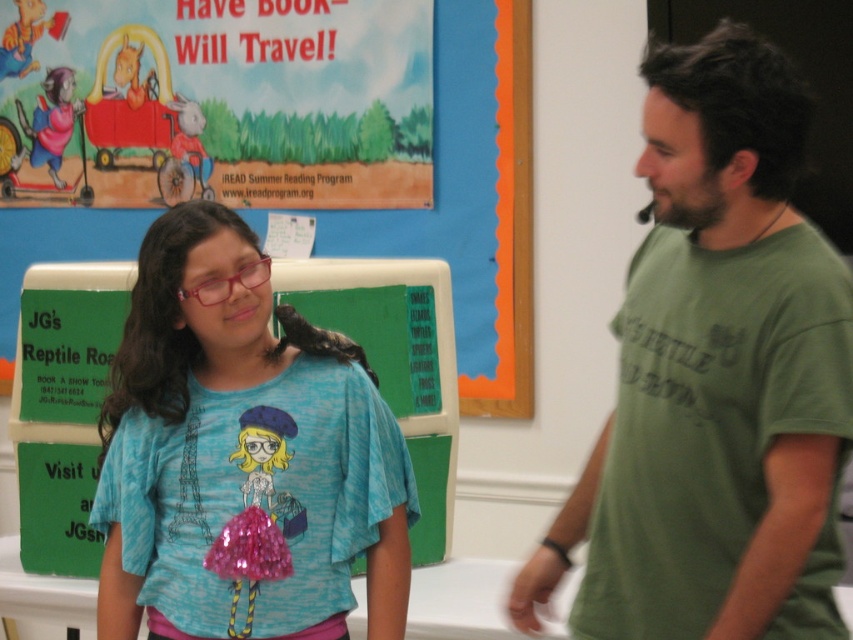
Question: From the image, what is the correct spatial relationship of green cotton t-shirt at right in relation to blue fabric shirt at center?

Choices:
 (A) right
 (B) left

Answer: (A)

Question: Is green cotton t-shirt at right to the right of matte paper poster at upper left from the viewer's perspective?

Choices:
 (A) no
 (B) yes

Answer: (B)

Question: Which point is farther to the camera?

Choices:
 (A) blue fabric shirt at center
 (B) matte paper poster at upper left

Answer: (B)

Question: Which object appears closest to the camera in this image?

Choices:
 (A) matte paper poster at upper left
 (B) green cotton t-shirt at right

Answer: (B)

Question: Is green cotton t-shirt at right bigger than matte paper poster at upper left?

Choices:
 (A) no
 (B) yes

Answer: (A)

Question: Which object is farther from the camera taking this photo?

Choices:
 (A) blue fabric shirt at center
 (B) matte paper poster at upper left
 (C) green cotton t-shirt at right

Answer: (B)